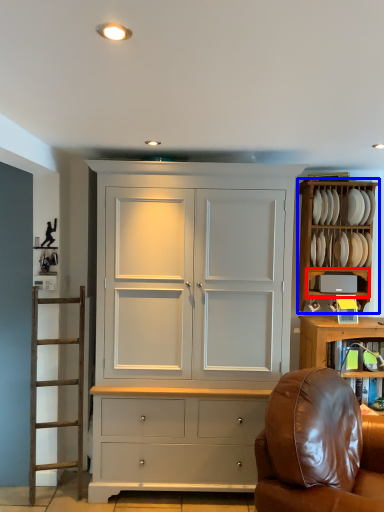
Question: Which of the following is the farthest to the observer, shelf (highlighted by a red box) or cabinetry (highlighted by a blue box)?

Choices:
 (A) shelf
 (B) cabinetry

Answer: (B)